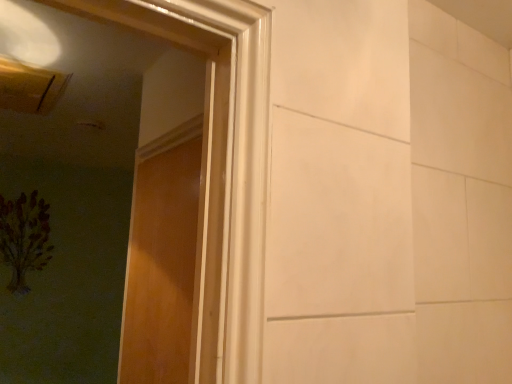
Question: Do you think wooden door at left is within brown textured painting at left, or outside of it?

Choices:
 (A) outside
 (B) inside

Answer: (A)

Question: Based on their sizes in the image, would you say wooden door at left is bigger or smaller than brown textured painting at left?

Choices:
 (A) big
 (B) small

Answer: (B)

Question: From the image's perspective, is wooden door at left located above or below brown textured painting at left?

Choices:
 (A) above
 (B) below

Answer: (A)

Question: In the image, is brown textured painting at left positioned in front of or behind wooden door at left?

Choices:
 (A) front
 (B) behind

Answer: (B)

Question: Based on their sizes in the image, would you say brown textured painting at left is bigger or smaller than wooden door at left?

Choices:
 (A) big
 (B) small

Answer: (A)

Question: Considering the positions of brown textured painting at left and wooden door at left in the image, is brown textured painting at left wider or thinner than wooden door at left?

Choices:
 (A) thin
 (B) wide

Answer: (B)

Question: Is point (34, 228) positioned closer to the camera than point (132, 354)?

Choices:
 (A) closer
 (B) farther

Answer: (B)